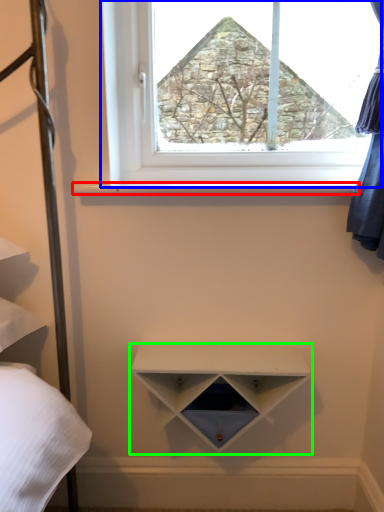
Question: Based on their relative distances, which object is nearer to window sill (highlighted by a red box)? Choose from window (highlighted by a blue box) and shelf (highlighted by a green box).

Choices:
 (A) window
 (B) shelf

Answer: (A)